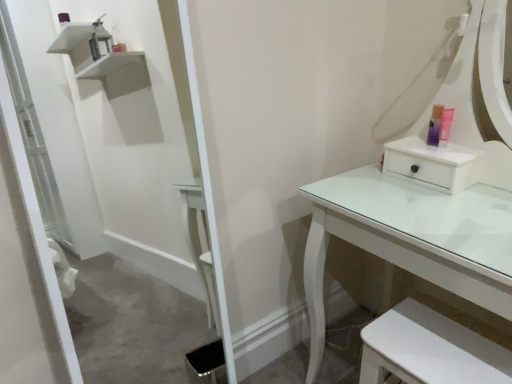
Identify the location of free point above white glossy step stool at lower right (from a real-world perspective). The image size is (512, 384). (448, 347).